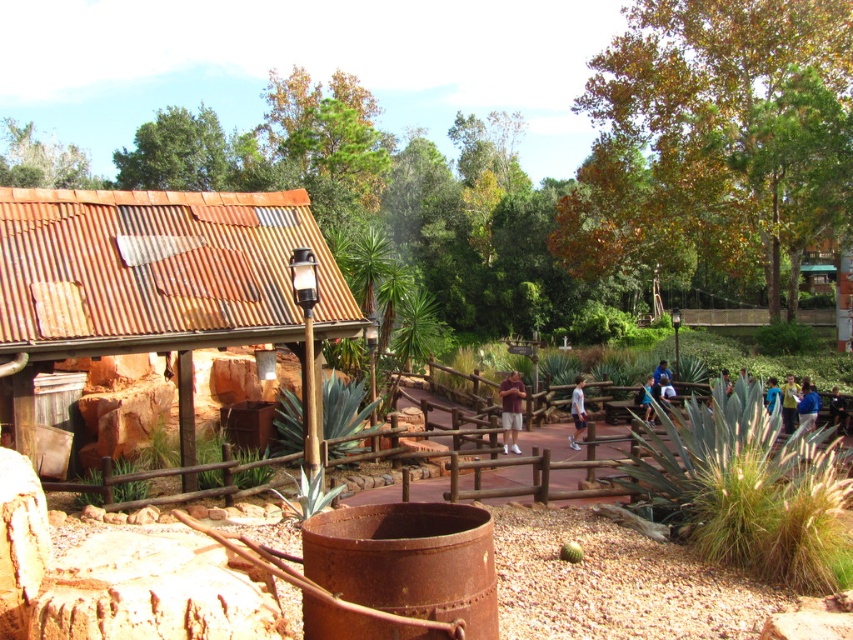
Which of these two, dark blue shirt at center or blue fabric shirt at center, stands shorter?

Standing shorter between the two is dark blue shirt at center.

Does dark blue shirt at center have a greater width compared to blue fabric shirt at center?

No, dark blue shirt at center is not wider than blue fabric shirt at center.

Is point (836, 401) closer to viewer compared to point (722, 385)?

No, it is behind (722, 385).

You are a GUI agent. You are given a task and a screenshot of the screen. Output one action in this format:
    pyautogui.click(x=<x>, y=<y>)
    Task: Click on the dark blue shirt at center
    This screenshot has height=640, width=853.
    Given the screenshot: What is the action you would take?
    pyautogui.click(x=838, y=412)

Does rusty corrugated metal hut at left have a smaller size compared to dark blue shirt at center?

Yes.

Locate an element on the screen. The width and height of the screenshot is (853, 640). rusty corrugated metal hut at left is located at coordinates (154, 282).

Is point (788, 404) behind point (814, 426)?

Yes, point (788, 404) is behind point (814, 426).

Consider the image. Can you confirm if yellow-green shirt at center-right is positioned below blue fabric shirt at lower right?

Yes.

At what (x,y) coordinates should I click in order to perform the action: click on yellow-green shirt at center-right. Please return your answer as a coordinate pair (x, y). The height and width of the screenshot is (640, 853). Looking at the image, I should click on (788, 404).